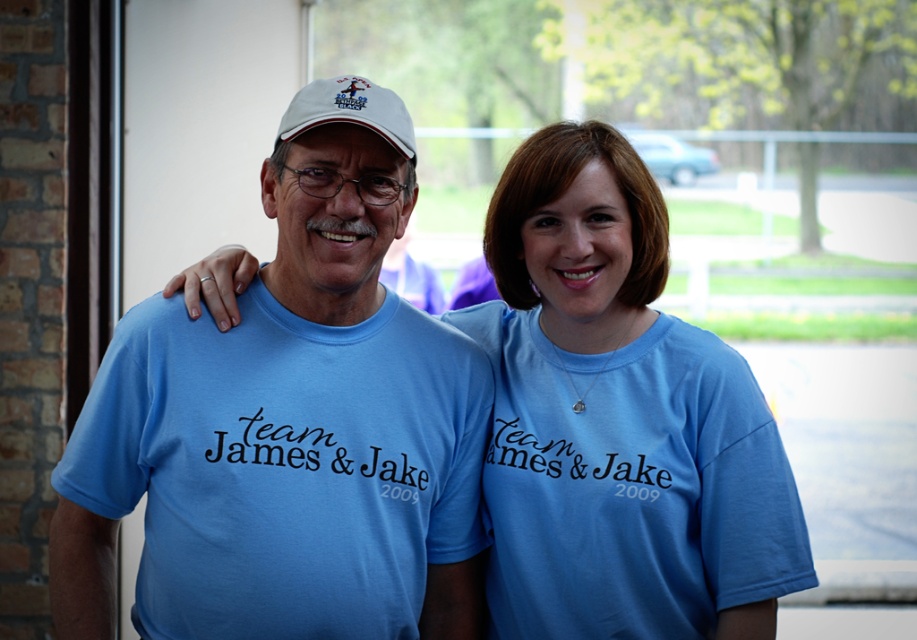
Question: Which object is closer to the camera taking this photo?

Choices:
 (A) white fabric baseball cap at upper center
 (B) blue cotton t-shirt at center

Answer: (A)

Question: Can you confirm if matte blue t-shirt at center is positioned to the left of white fabric baseball cap at upper center?

Choices:
 (A) yes
 (B) no

Answer: (A)

Question: Does blue cotton t-shirt at center have a smaller size compared to white fabric baseball cap at upper center?

Choices:
 (A) yes
 (B) no

Answer: (B)

Question: Which point is closer to the camera?

Choices:
 (A) (305, 116)
 (B) (570, 532)

Answer: (A)

Question: Does blue cotton t-shirt at center have a lesser width compared to white fabric baseball cap at upper center?

Choices:
 (A) yes
 (B) no

Answer: (B)

Question: Which point is closer to the camera?

Choices:
 (A) white fabric baseball cap at upper center
 (B) matte blue t-shirt at center
 (C) blue cotton t-shirt at center

Answer: (B)